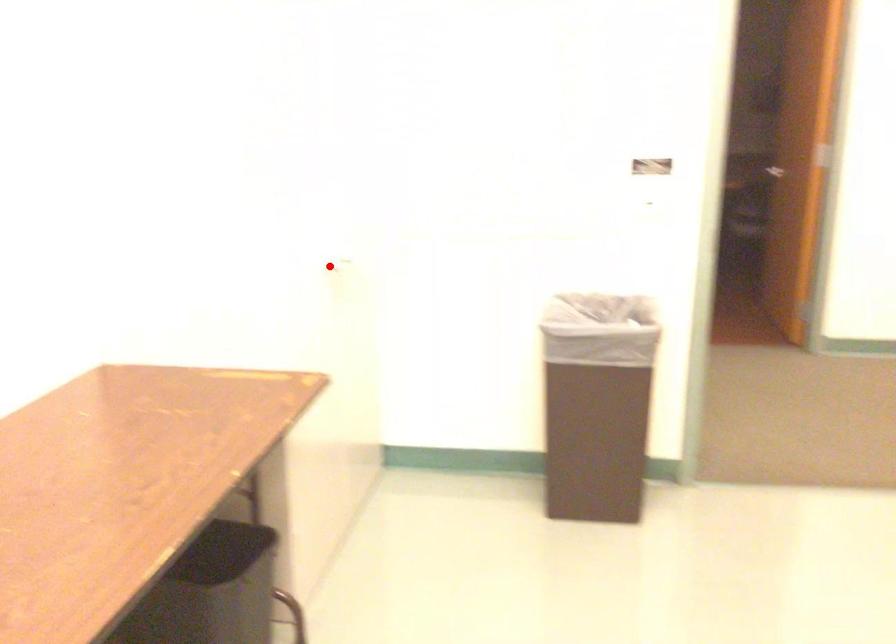
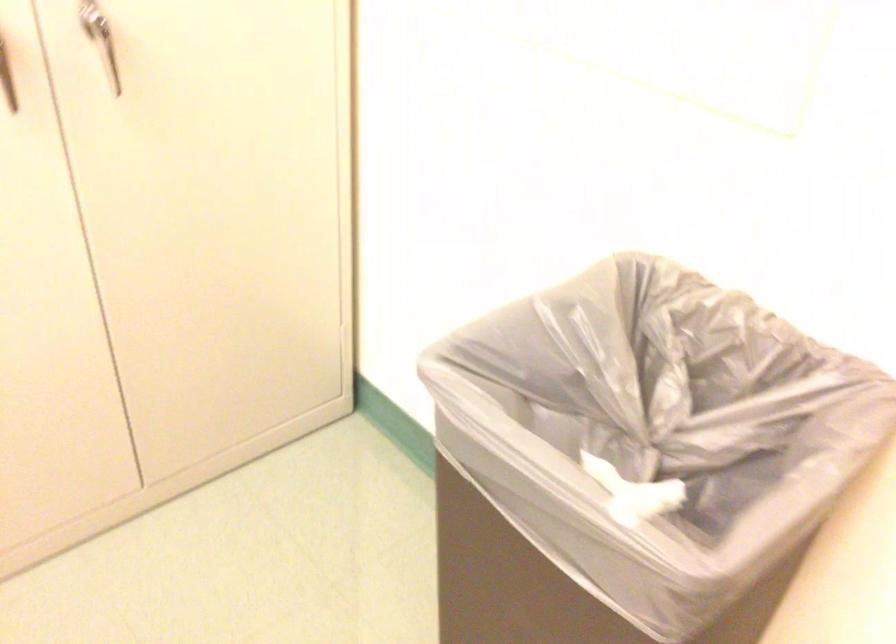
Question: I am providing you with two images of the same scene from different viewpoints. Given a red point in image1, look at the same physical point in image2. Is it:

Choices:
 (A) Closer to the viewpoint
 (B) Farther from the viewpoint

Answer: (A)